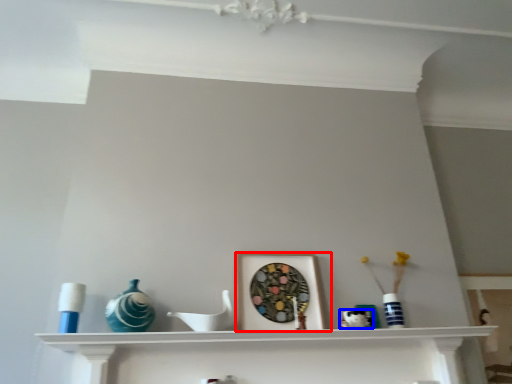
Question: Which of the following is the closest to the observer, picture frame (highlighted by a red box) or art (highlighted by a blue box)?

Choices:
 (A) picture frame
 (B) art

Answer: (B)